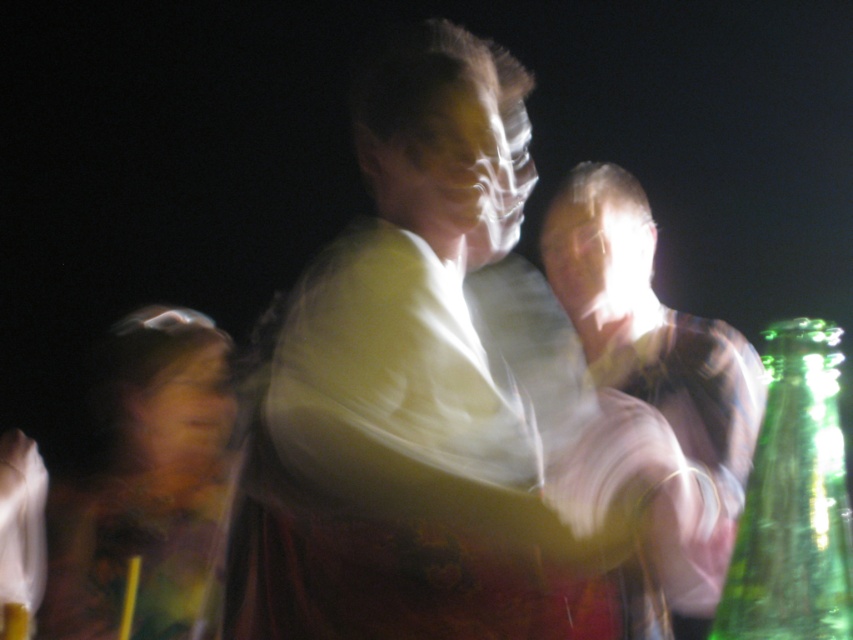
Question: Does matte white shirt at center appear on the left side of green glass bottle at right?

Choices:
 (A) yes
 (B) no

Answer: (B)

Question: Which of the following is the closest to the observer?

Choices:
 (A) matte floral dress at lower left
 (B) matte white shirt at center

Answer: (B)

Question: Which point is farther from the camera taking this photo?

Choices:
 (A) (641, 326)
 (B) (491, 236)
 (C) (846, 522)

Answer: (A)

Question: Estimate the real-world distances between objects in this image. Which object is farther from the matte floral dress at lower left?

Choices:
 (A) matte white shirt at center
 (B) white matte shirt at center
 (C) green glass bottle at right

Answer: (C)

Question: Is white matte shirt at center positioned in front of green glass bottle at right?

Choices:
 (A) no
 (B) yes

Answer: (A)

Question: Is matte white shirt at center below green glass bottle at right?

Choices:
 (A) no
 (B) yes

Answer: (A)